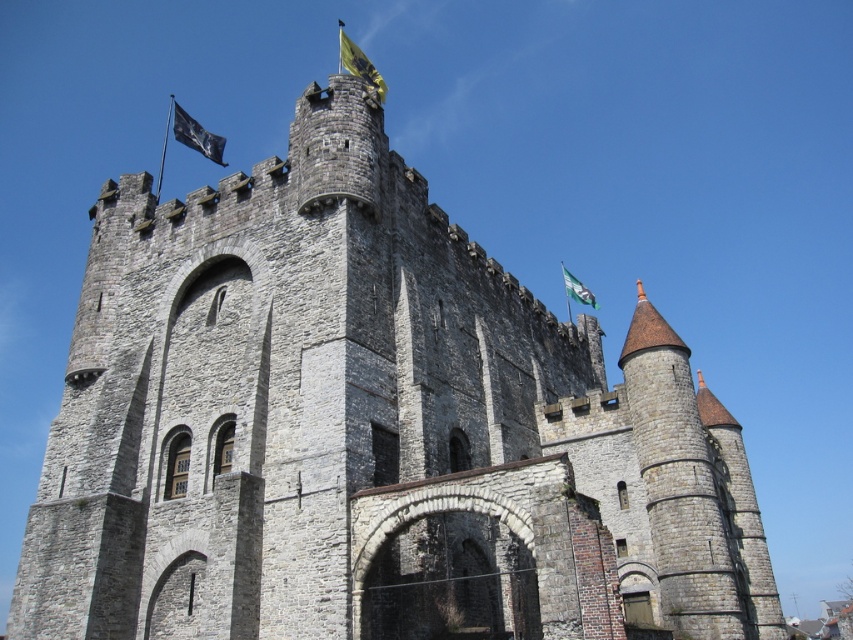
Which of these two, yellow fabric flag at upper center or white fabric flag at upper right, stands shorter?

With less height is white fabric flag at upper right.

Between yellow fabric flag at upper center and white fabric flag at upper right, which one appears on the right side from the viewer's perspective?

white fabric flag at upper right is more to the right.

You are a GUI agent. You are given a task and a screenshot of the screen. Output one action in this format:
    pyautogui.click(x=<x>, y=<y>)
    Task: Click on the yellow fabric flag at upper center
    
    Given the screenshot: What is the action you would take?
    pyautogui.click(x=358, y=65)

Is black fabric flag at upper left further to the viewer compared to yellow fabric flag at upper center?

That is True.

Which is in front, point (225, 163) or point (345, 38)?

Point (345, 38)

What are the coordinates of `black fabric flag at upper left` in the screenshot? It's located at (196, 134).

Is black fabric flag at upper left thinner than white fabric flag at upper right?

No.

How much distance is there between black fabric flag at upper left and white fabric flag at upper right?

101.87 meters

Who is more distant from viewer, (186, 113) or (593, 304)?

The point (186, 113) is behind.

Locate an element on the screen. black fabric flag at upper left is located at coordinates (196, 134).